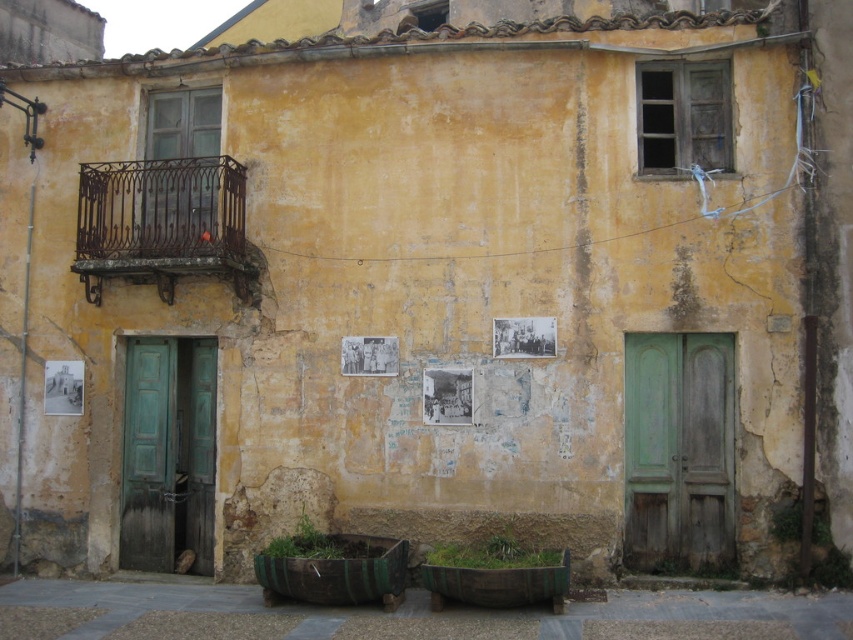
Question: Is the position of green wood door at right less distant than that of wrought iron balcony at upper left?

Choices:
 (A) yes
 (B) no

Answer: (A)

Question: Does green wood door at right appear over wrought iron balcony at upper left?

Choices:
 (A) yes
 (B) no

Answer: (B)

Question: Can you confirm if green wood door at right is positioned below wrought iron balcony at upper left?

Choices:
 (A) no
 (B) yes

Answer: (B)

Question: Which object appears closest to the camera in this image?

Choices:
 (A) green wooden door at lower left
 (B) wrought iron balcony at upper left
 (C) green wood door at right

Answer: (C)

Question: Which of these objects is positioned farthest from the green wooden door at lower left?

Choices:
 (A) wrought iron balcony at upper left
 (B) green wood door at right

Answer: (B)

Question: Which point is farther to the camera?

Choices:
 (A) (708, 547)
 (B) (148, 536)

Answer: (B)